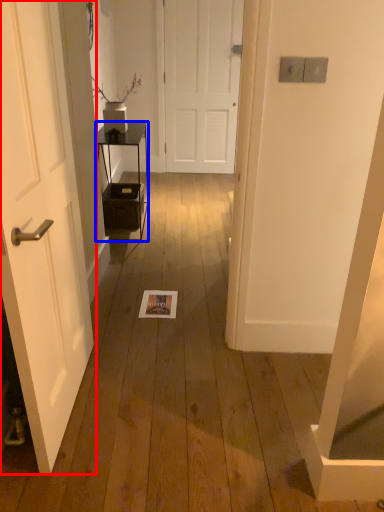
Question: Which of the following is the farthest to the observer, door (highlighted by a red box) or furniture (highlighted by a blue box)?

Choices:
 (A) door
 (B) furniture

Answer: (B)